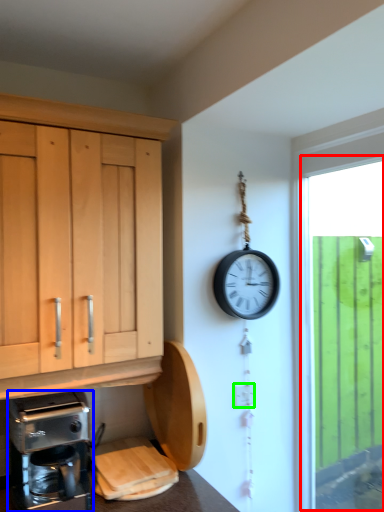
Question: Which is nearer to the window (highlighted by a red box)? coffee maker (highlighted by a blue box) or electric outlet (highlighted by a green box).

Choices:
 (A) coffee maker
 (B) electric outlet

Answer: (B)